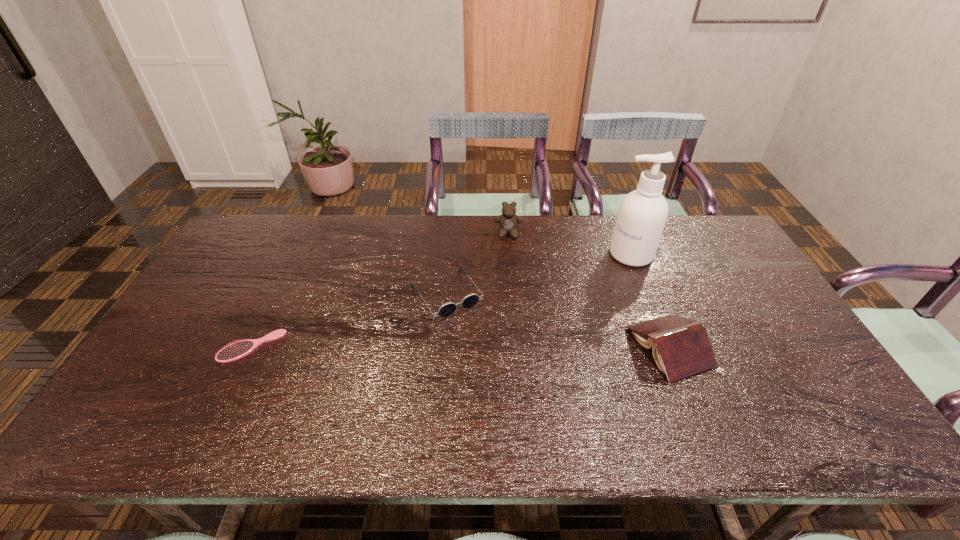
The width and height of the screenshot is (960, 540). Identify the location of hairbrush. (237, 350).

Locate an element on the screen. Image resolution: width=960 pixels, height=540 pixels. the shortest object is located at coordinates (237, 350).

Image resolution: width=960 pixels, height=540 pixels. I want to click on book, so pos(680,346).

Where is `sunglasses`? This screenshot has height=540, width=960. sunglasses is located at coordinates (470, 300).

Locate an element on the screen. The image size is (960, 540). the fourth object from right to left is located at coordinates (470, 300).

Where is `cleansing agent`? This screenshot has height=540, width=960. cleansing agent is located at coordinates (642, 215).

This screenshot has width=960, height=540. Find the location of `the second farthest object`. the second farthest object is located at coordinates (642, 215).

The image size is (960, 540). Identify the location of the farthest object. (508, 221).

At what (x,y) coordinates should I click in order to perform the action: click on the fourth shortest object. Please return your answer as a coordinate pair (x, y). This screenshot has width=960, height=540. Looking at the image, I should click on (508, 221).

This screenshot has width=960, height=540. I want to click on free spot located on the left of the leftmost object, so coord(162,346).